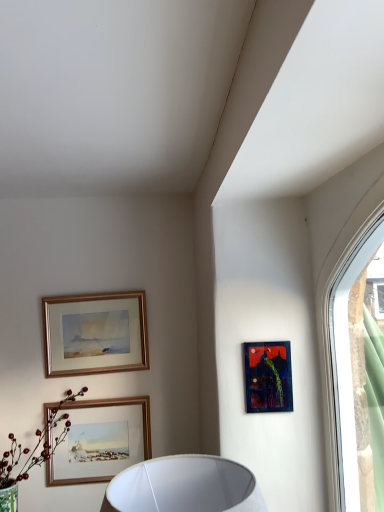
Question: From a real-world perspective, is wooden-framed painting at upper left, which appears as the 1th picture frame when viewed from the back, on top of clear glass window at upper right?

Choices:
 (A) no
 (B) yes

Answer: (B)

Question: Would you say clear glass window at upper right is part of wooden-framed painting at upper left, which appears as the 1th picture frame when viewed from the back,'s contents?

Choices:
 (A) yes
 (B) no

Answer: (B)

Question: Can you confirm if wooden-framed painting at upper left, placed as the first picture frame when sorted from top to bottom, is smaller than clear glass window at upper right?

Choices:
 (A) no
 (B) yes

Answer: (B)

Question: Are wooden-framed painting at upper left, which appears as the first picture frame when viewed from the left, and clear glass window at upper right far apart?

Choices:
 (A) no
 (B) yes

Answer: (B)

Question: From a real-world perspective, does wooden-framed painting at upper left, which appears as the 1th picture frame when viewed from the back, sit lower than clear glass window at upper right?

Choices:
 (A) no
 (B) yes

Answer: (A)

Question: From the image's perspective, relative to clear glass window at upper right, is wooden-framed painting at upper left, placed as the 3th picture frame when sorted from front to back, above or below?

Choices:
 (A) above
 (B) below

Answer: (B)

Question: Looking at the image, does wooden-framed painting at upper left, marked as the 3th picture frame in a bottom-to-top arrangement, seem bigger or smaller compared to clear glass window at upper right?

Choices:
 (A) small
 (B) big

Answer: (A)

Question: From a real-world perspective, is wooden-framed painting at upper left, which appears as the first picture frame when viewed from the left, above or below clear glass window at upper right?

Choices:
 (A) below
 (B) above

Answer: (B)

Question: Considering the relative positions of wooden-framed painting at upper left, placed as the first picture frame when sorted from top to bottom, and clear glass window at upper right in the image provided, is wooden-framed painting at upper left, placed as the first picture frame when sorted from top to bottom, to the left or to the right of clear glass window at upper right?

Choices:
 (A) left
 (B) right

Answer: (A)

Question: From a real-world perspective, is clear glass window at upper right physically located above or below wooden framed picture at lower center, arranged as the first picture frame when ordered from the bottom?

Choices:
 (A) above
 (B) below

Answer: (A)

Question: Is clear glass window at upper right spatially inside wooden framed picture at lower center, arranged as the second picture frame when viewed from the front, or outside of it?

Choices:
 (A) outside
 (B) inside

Answer: (A)

Question: Looking at their shapes, would you say clear glass window at upper right is wider or thinner than wooden framed picture at lower center, which ranks as the second picture frame in back-to-front order?

Choices:
 (A) wide
 (B) thin

Answer: (A)

Question: Is point (337, 373) positioned closer to the camera than point (114, 400)?

Choices:
 (A) closer
 (B) farther

Answer: (A)

Question: Choose the correct answer: Is wooden-framed painting at upper left, acting as the third picture frame starting from the right, inside green matte flower at lower left or outside it?

Choices:
 (A) inside
 (B) outside

Answer: (B)

Question: Looking at their shapes, would you say wooden-framed painting at upper left, marked as the 3th picture frame in a bottom-to-top arrangement, is wider or thinner than green matte flower at lower left?

Choices:
 (A) thin
 (B) wide

Answer: (A)